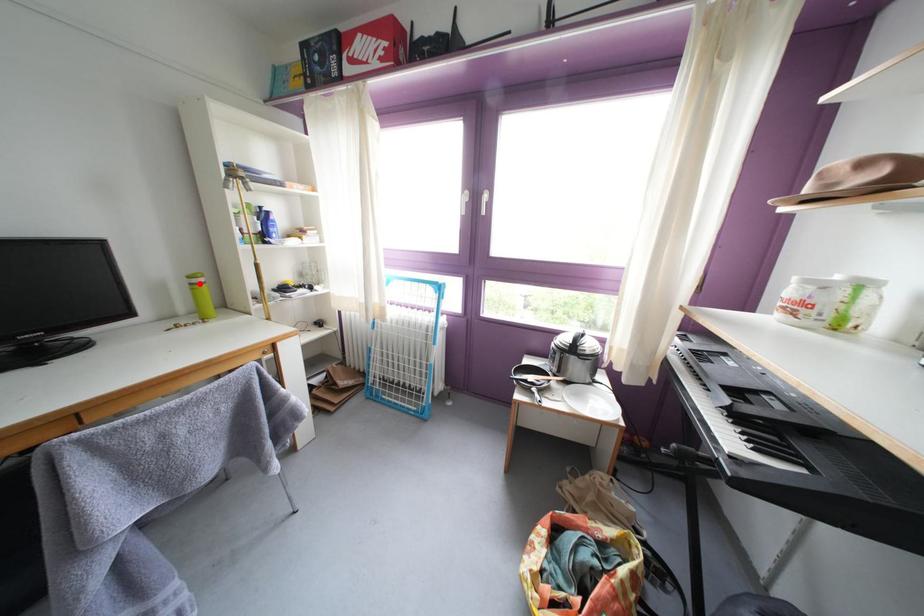
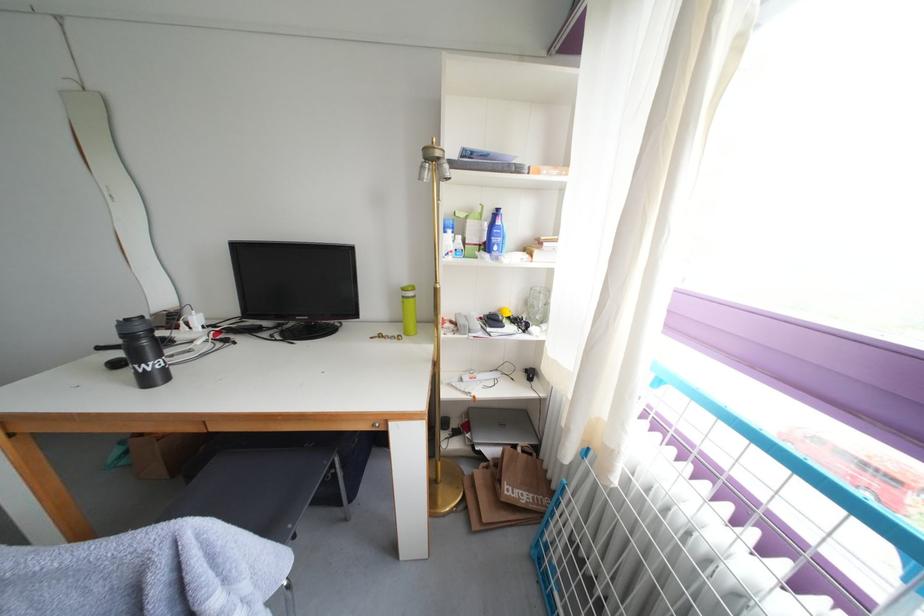
Find the pixel in the second image that matches the highlighted location in the first image.

(414, 294)